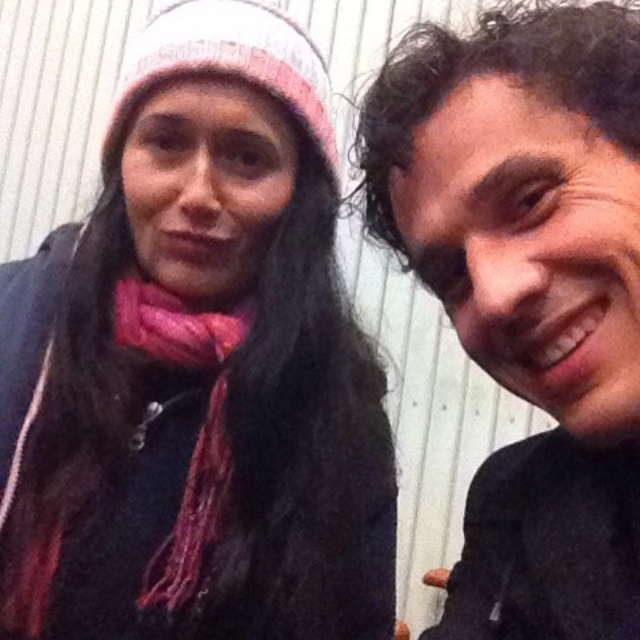
Question: Which of the following is the farthest from the observer?

Choices:
 (A) click(212, 385)
 (B) click(536, 586)

Answer: (A)

Question: Is matte black shirt at right smaller than pink knitted scarf at left?

Choices:
 (A) no
 (B) yes

Answer: (A)

Question: Considering the relative positions of matte black shirt at right and pink knitted scarf at left in the image provided, where is matte black shirt at right located with respect to pink knitted scarf at left?

Choices:
 (A) left
 (B) right

Answer: (B)

Question: Is matte black shirt at right to the left of pink knitted scarf at left from the viewer's perspective?

Choices:
 (A) yes
 (B) no

Answer: (B)